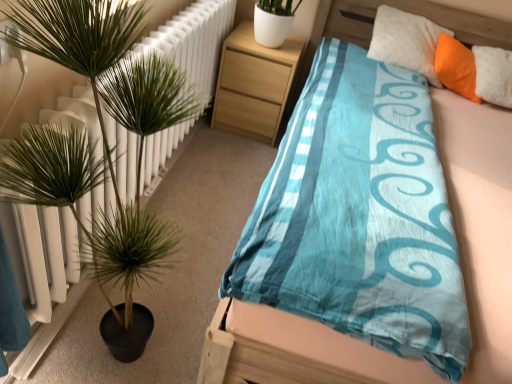
What are the coordinates of `free space above light wood/texture nightstand at upper center (from a real-world perspective)` in the screenshot? It's located at (262, 46).